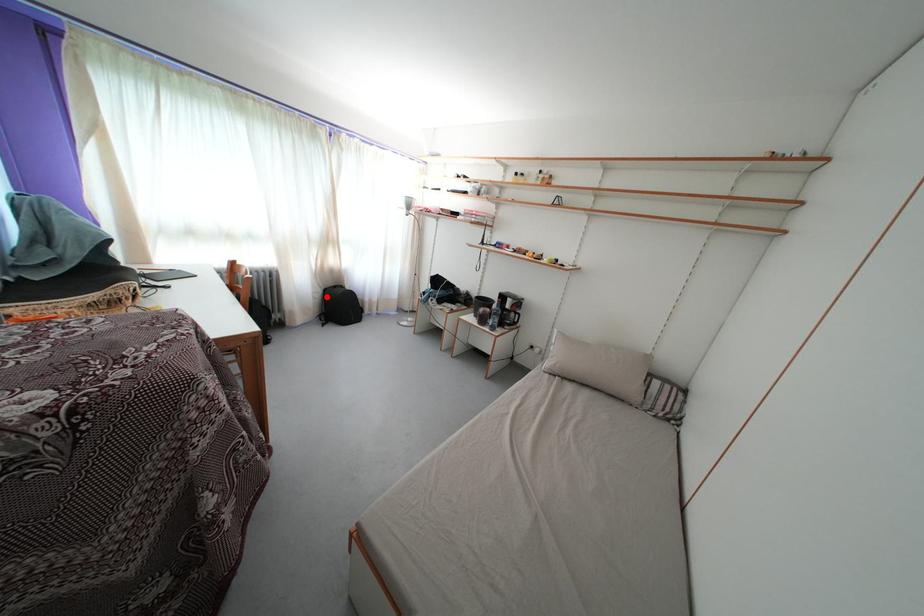
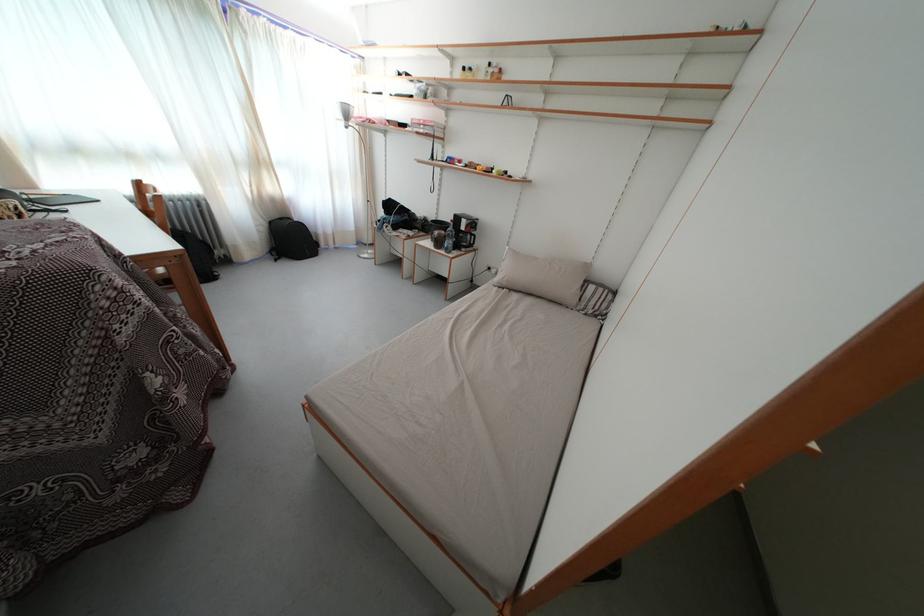
Question: I am providing you with two images of the same scene from different viewpoints. Image1 has a red point marked. In image2, the corresponding 3D location appears at what relative position? Reply with the corresponding letter.

Choices:
 (A) Closer
 (B) Farther

Answer: (A)